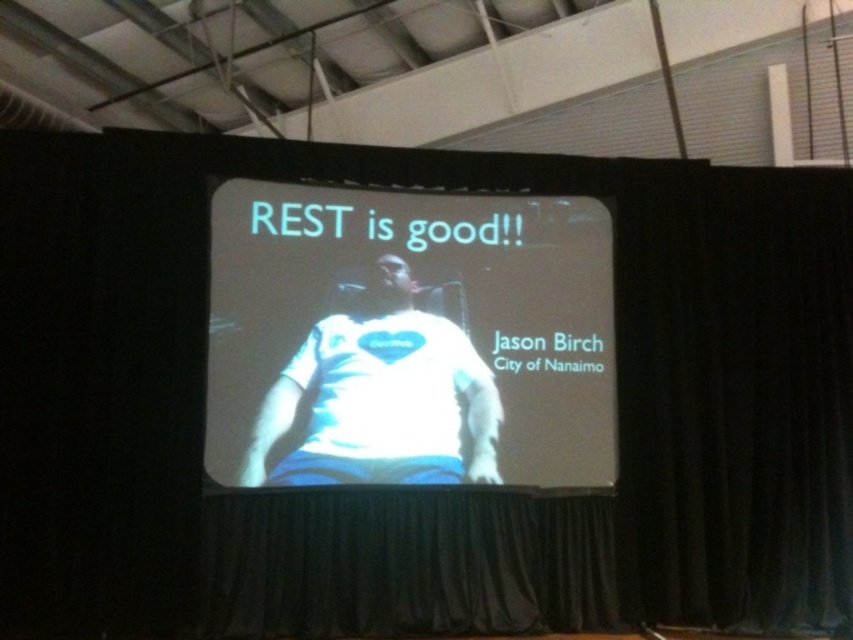
Question: Which point appears farthest from the camera in this image?

Choices:
 (A) (514, 234)
 (B) (271, 394)

Answer: (A)

Question: Which of the following is the closest to the observer?

Choices:
 (A) white fabric shirt at center
 (B) white glossy projector screen at center

Answer: (B)

Question: Which object is farther from the camera taking this photo?

Choices:
 (A) white fabric shirt at center
 (B) white glossy projector screen at center

Answer: (A)

Question: Does white glossy projector screen at center come in front of white fabric shirt at center?

Choices:
 (A) no
 (B) yes

Answer: (B)

Question: Is the position of white glossy projector screen at center less distant than that of white fabric shirt at center?

Choices:
 (A) yes
 (B) no

Answer: (A)

Question: Does white glossy projector screen at center have a smaller size compared to white fabric shirt at center?

Choices:
 (A) yes
 (B) no

Answer: (B)